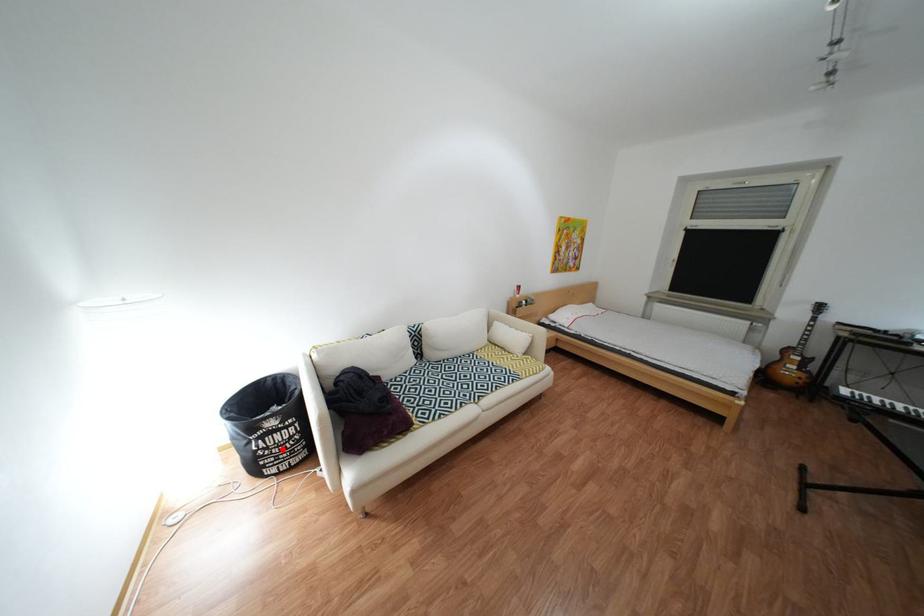
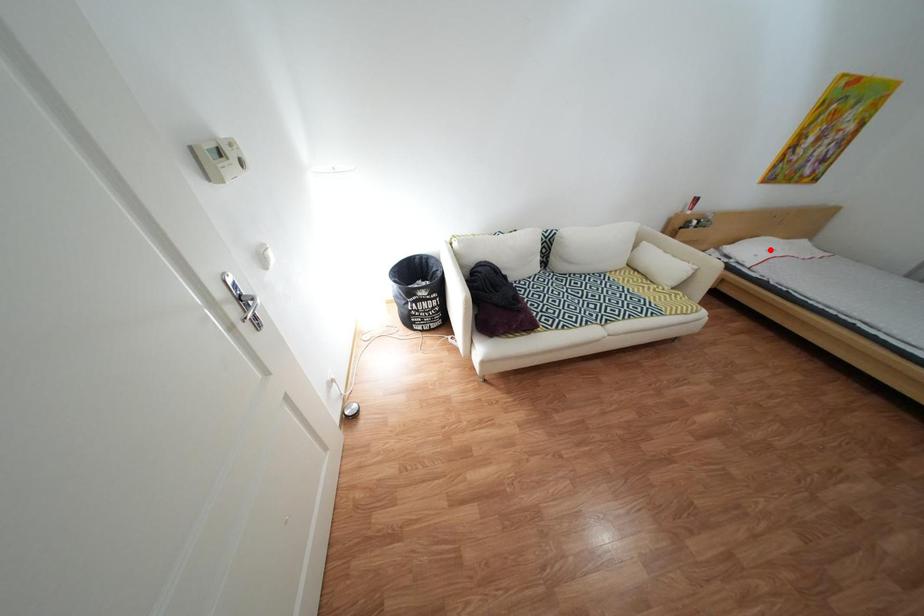
I am providing you with two images of the same scene from different viewpoints. A red point is marked on the first image and another point is marked on the second image. Does the point marked in image1 correspond to the same location as the one in image2?

No